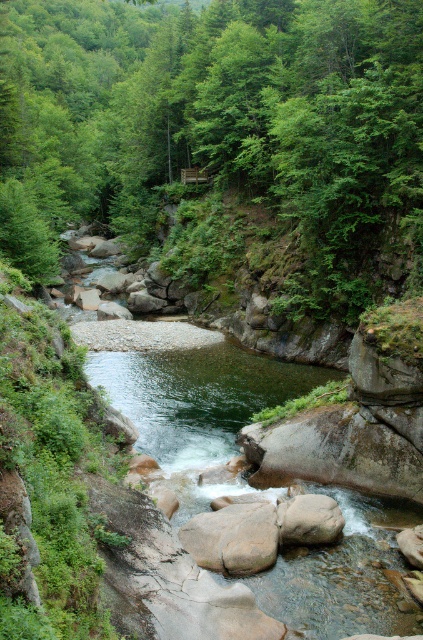
Question: Considering the real-world distances, which object is farthest from the smooth gray rock at center?

Choices:
 (A) brown rough boulder at center
 (B) green leafy tree at center

Answer: (B)

Question: Based on their relative distances, which object is farther from the brown rough boulder at center?

Choices:
 (A) green leafy tree at center
 (B) smooth gray rock at center

Answer: (A)

Question: Is green leafy tree at center bigger than brown rough boulder at center?

Choices:
 (A) yes
 (B) no

Answer: (A)

Question: Which object appears closest to the camera in this image?

Choices:
 (A) brown rough boulder at center
 (B) smooth gray rock at center

Answer: (A)

Question: Is green leafy tree at center in front of smooth gray rock at center?

Choices:
 (A) yes
 (B) no

Answer: (B)

Question: Does green leafy tree at center come behind smooth gray rock at center?

Choices:
 (A) no
 (B) yes

Answer: (B)